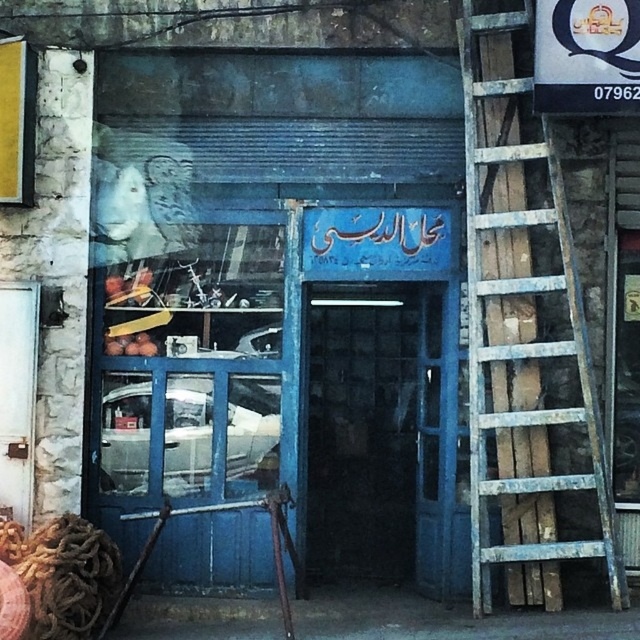
You are a painter who needs to reach a high point on the wall. You see the rusty wood ladder at right and the blue glass door at center. Which object is taller and can provide better support for reaching the height?

The rusty wood ladder at right has a greater height compared to the blue glass door at center, so it can provide better support for reaching the height.

You are a delivery person trying to deliver a package to the shop through the blue glass door at center. The rusty wood ladder at right is blocking the path. Can you move the ladder to the side to access the door?

The rusty wood ladder at right has a lesser width compared to blue glass door at center, so it can be moved to the side without obstructing the door. You can move the ladder to access the door.